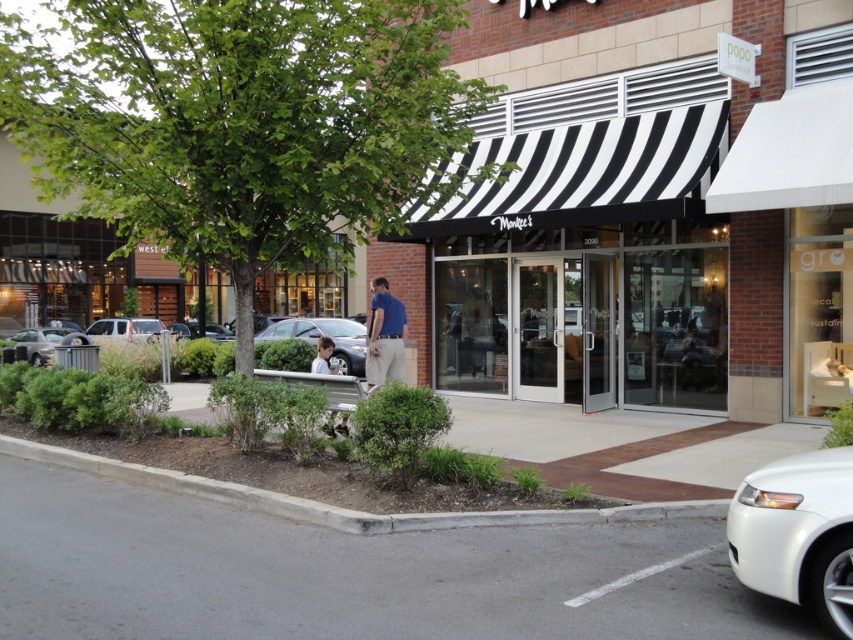
You are standing at the entrance of Monkee store. You want to park your car in the parking spot located at point 0.523, 0.381. Is there a silver metallic car at center blocking your way?

Yes, there is a silver metallic car at center located at point (323, 333), which is exactly where you want to park. Therefore, the silver metallic car at center is blocking your way.

You are standing at the entrance of Monkee store and want to park your car. Is the silver metallic sedan at left at point (125, 328) a good spot for parking?

The silver metallic sedan at left is located at point (125, 328), so it is already parked there. Therefore, that spot is occupied and not available for parking.